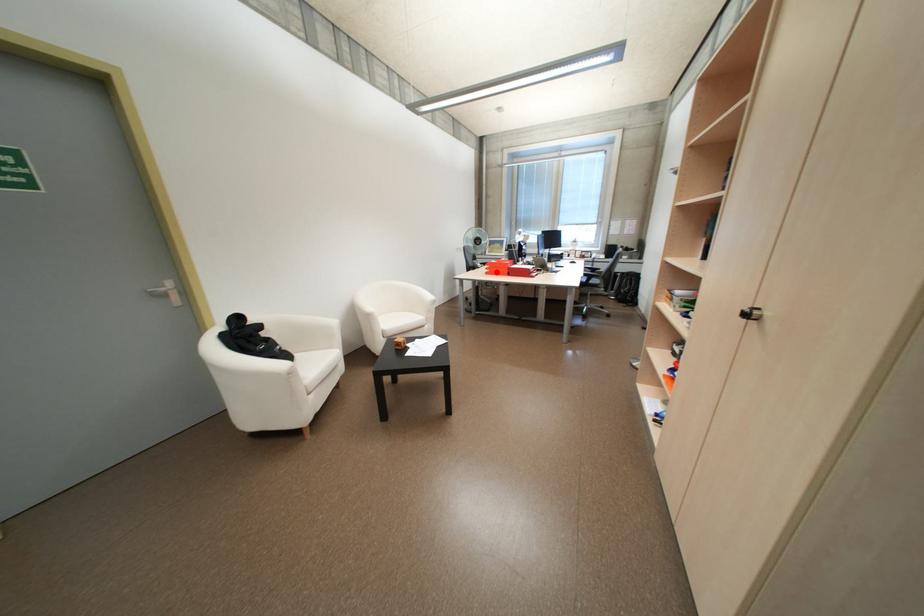
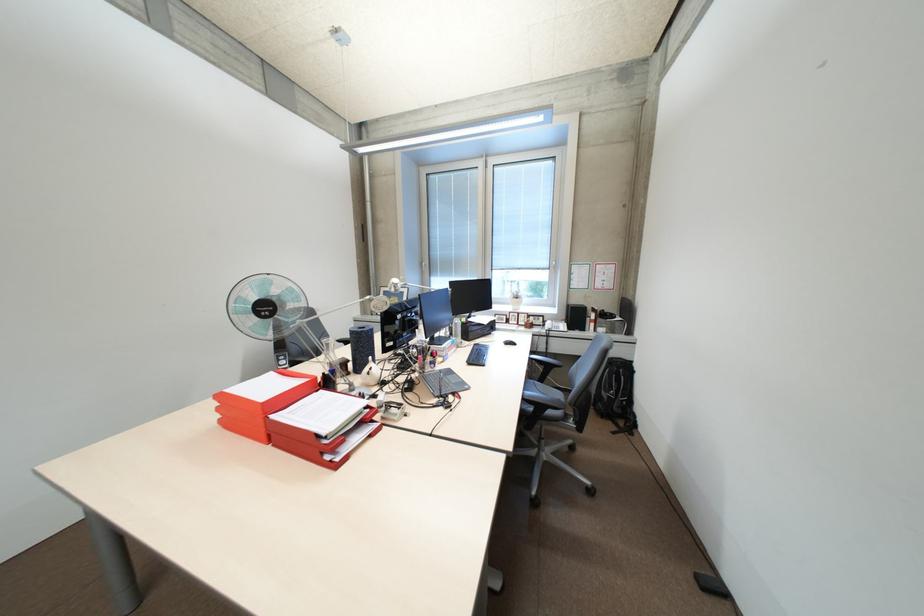
Question: I am providing you with two images of the same scene from different viewpoints. In image1, a red point is highlighted. Considering the same 3D point in image2, which of the following is correct?

Choices:
 (A) It is closer
 (B) It is farther

Answer: (B)